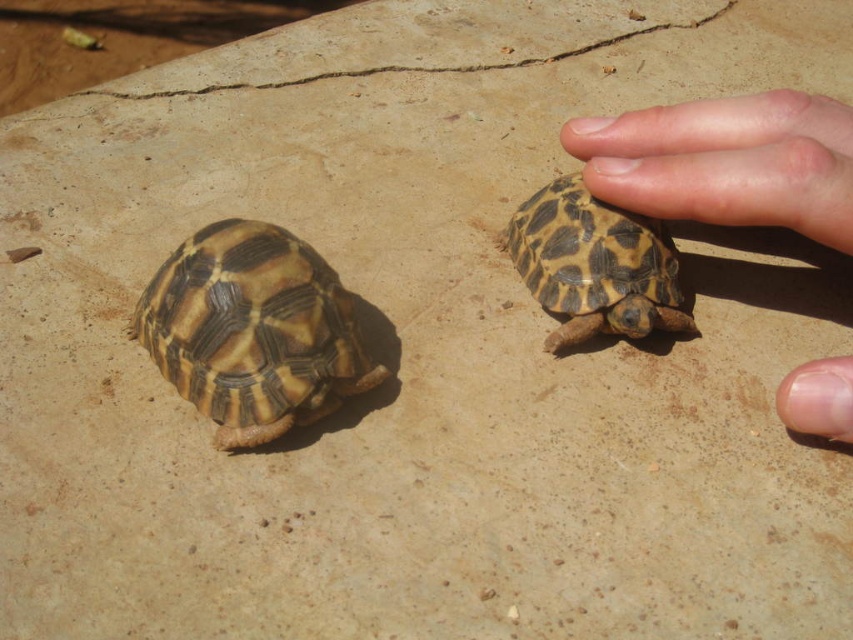
You are a small robot with a 30 cm wide base. You need to move from the left side of the image to the right side without getting too close to the smooth skin hand at right. Can you safely pass through the space between the turtles and the hand?

The smooth skin hand at right and viewer are 62.87 centimeters apart. Since the robot is 30 cm wide, it can safely pass through the space as 62.87 cm is more than enough width to avoid the hand while moving from left to right.

You are a child trying to decide which object is wider between the brown textured tortoise at left and the pale skin at upper right. Which one is wider?

The brown textured tortoise at left is wider than the pale skin at upper right.

You are a small insect observing the scene. Which of the two skin parts, the smooth skin hand at right or the pale skin at upper right, would appear bigger to you?

The smooth skin hand at right is larger in size compared to the pale skin at upper right, so it would appear bigger to the small insect.